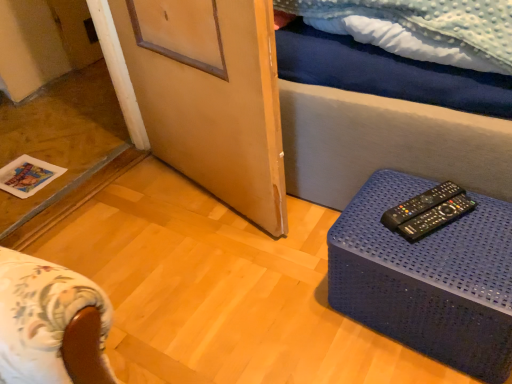
The width and height of the screenshot is (512, 384). In order to click on unoccupied area behind black plastic remote controls at right, which ranks as the 1th remote control in front-to-back order in this screenshot , I will do `click(400, 185)`.